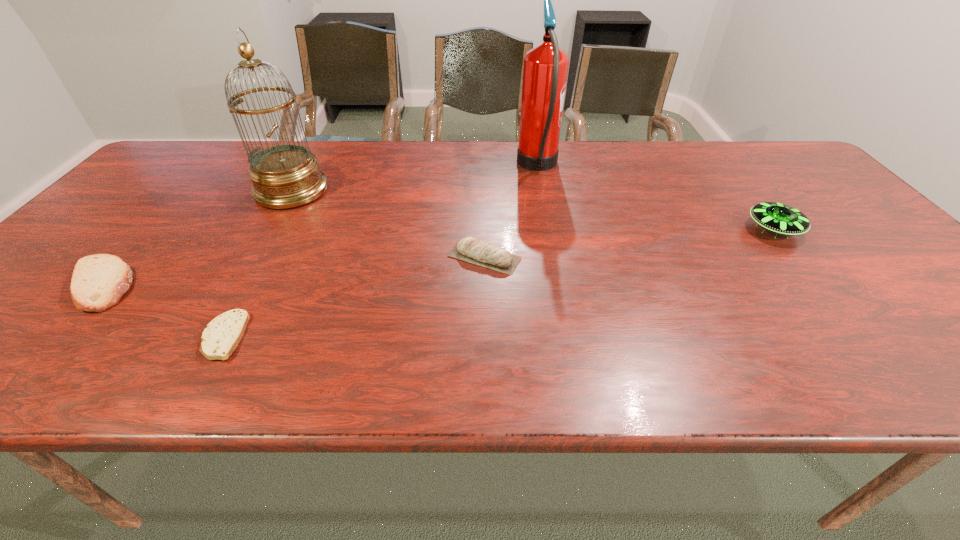
Where is `the fifth object from left to right`? The image size is (960, 540). the fifth object from left to right is located at coordinates (545, 70).

Locate an element on the screen. This screenshot has height=540, width=960. birdcage is located at coordinates (284, 176).

You are a GUI agent. You are given a task and a screenshot of the screen. Output one action in this format:
    pyautogui.click(x=<x>, y=<y>)
    Task: Click on the rightmost object
    
    Given the screenshot: What is the action you would take?
    pyautogui.click(x=780, y=218)

Locate an element on the screen. This screenshot has height=540, width=960. saucer is located at coordinates (780, 218).

What are the coordinates of `the rightmost pita bread` in the screenshot? It's located at coord(469,249).

Identify the location of the leftmost object. (98, 282).

The height and width of the screenshot is (540, 960). In order to click on the leftmost pita bread in this screenshot , I will do `click(98, 282)`.

Identify the location of the shortest pita bread. This screenshot has height=540, width=960. (221, 336).

Locate an element on the screen. the second pita bread from left to right is located at coordinates (221, 336).

Identify the location of free region located 0.050m on the front of the fifth object from left to right. (545, 203).